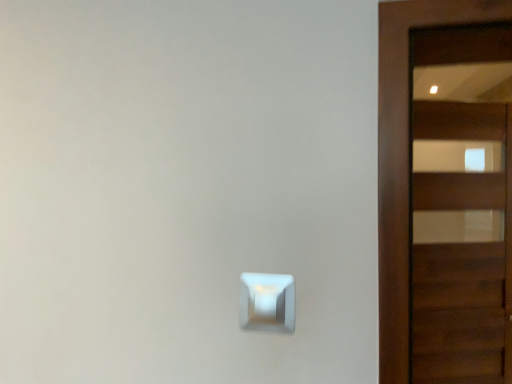
Question: Considering the positions of white glossy light switch at center and wooden door at right in the image, is white glossy light switch at center taller or shorter than wooden door at right?

Choices:
 (A) short
 (B) tall

Answer: (A)

Question: In the image, is white glossy light switch at center positioned in front of or behind wooden door at right?

Choices:
 (A) front
 (B) behind

Answer: (A)

Question: From a real-world perspective, relative to wooden door at right, is white glossy light switch at center vertically above or below?

Choices:
 (A) below
 (B) above

Answer: (A)

Question: From a real-world perspective, relative to white glossy light switch at center, is wooden door at right vertically above or below?

Choices:
 (A) above
 (B) below

Answer: (A)

Question: Is wooden door at right in front of or behind white glossy light switch at center in the image?

Choices:
 (A) behind
 (B) front

Answer: (A)

Question: Looking at their shapes, would you say wooden door at right is wider or thinner than white glossy light switch at center?

Choices:
 (A) thin
 (B) wide

Answer: (B)

Question: In terms of size, does wooden door at right appear bigger or smaller than white glossy light switch at center?

Choices:
 (A) small
 (B) big

Answer: (B)